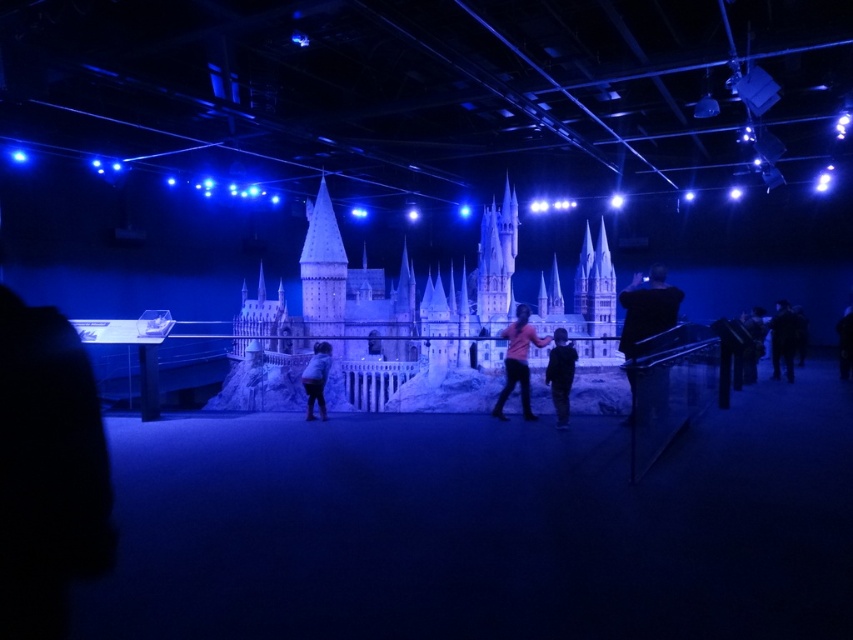
Can you confirm if dark blue fabric jacket at center is positioned to the right of white fabric bag at center?

Yes, dark blue fabric jacket at center is to the right of white fabric bag at center.

Is dark blue fabric jacket at center shorter than white fabric bag at center?

Incorrect, dark blue fabric jacket at center's height does not fall short of white fabric bag at center's.

Image resolution: width=853 pixels, height=640 pixels. Describe the element at coordinates (560, 374) in the screenshot. I see `dark blue fabric jacket at center` at that location.

Where is `dark blue fabric jacket at center`? dark blue fabric jacket at center is located at coordinates (560, 374).

Locate an element on the screen. The width and height of the screenshot is (853, 640). matte plastic castle at center is located at coordinates (383, 292).

Is matte plastic castle at center smaller than pink matte shirt at center?

No, matte plastic castle at center is not smaller than pink matte shirt at center.

Is matte plastic castle at center above pink matte shirt at center?

Yes.

In order to click on matte plastic castle at center in this screenshot , I will do `click(383, 292)`.

I want to click on matte plastic castle at center, so [x=383, y=292].